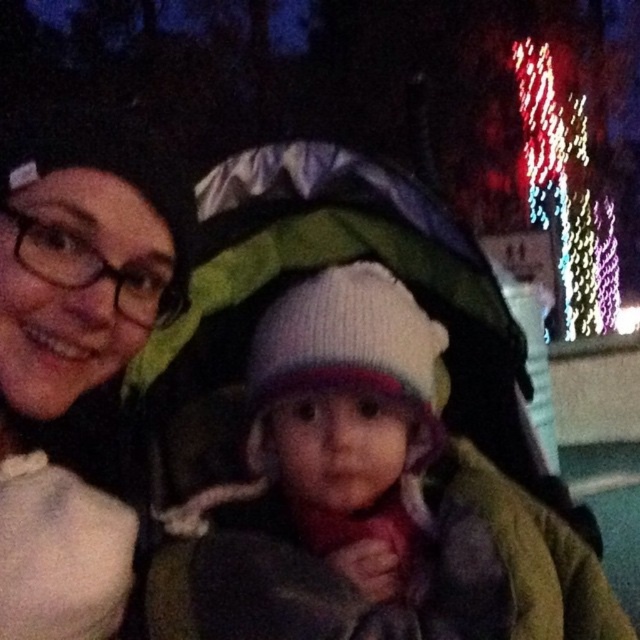
You are a photographer setting up a shot of the nighttime scene. You need to place a small tripod between the matte black beanie at upper left and the multicolored fabric baby carriage at center. Given their sizes, will the space between them be sufficient for the tripod?

The matte black beanie at upper left occupies less space than the multicolored fabric baby carriage at center, so the space between them should be sufficient for placing the tripod.

You are a photographer adjusting the camera focus for the scene. The camera has a focus grid with coordinates from 0 to 1 on both axes. You need to focus on the matte black beanie at upper left. What are the coordinates where you should set the focus?

The coordinates for the matte black beanie at upper left are at point (76, 355), so you should set the focus there.